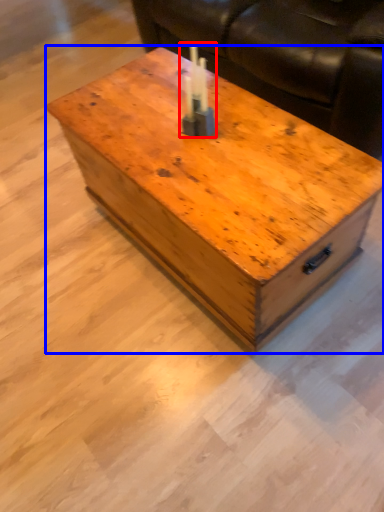
Question: Which point is closer to the camera, birthday candle (highlighted by a red box) or coffee table (highlighted by a blue box)?

Choices:
 (A) birthday candle
 (B) coffee table

Answer: (B)